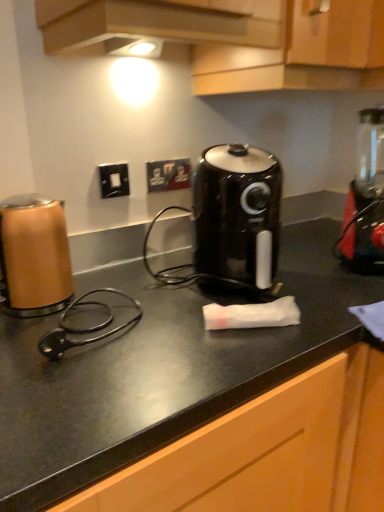
Question: From a real-world perspective, is red plastic blender at right physically above black matte countertop at center?

Choices:
 (A) no
 (B) yes

Answer: (B)

Question: Does red plastic blender at right have a greater height compared to black matte countertop at center?

Choices:
 (A) yes
 (B) no

Answer: (B)

Question: Can you confirm if red plastic blender at right is positioned to the left of black matte countertop at center?

Choices:
 (A) yes
 (B) no

Answer: (B)

Question: Is red plastic blender at right outside of black matte countertop at center?

Choices:
 (A) no
 (B) yes

Answer: (B)

Question: Can you confirm if red plastic blender at right is positioned to the right of black matte countertop at center?

Choices:
 (A) no
 (B) yes

Answer: (B)

Question: Is red plastic blender at right thinner than black matte countertop at center?

Choices:
 (A) yes
 (B) no

Answer: (A)

Question: Is black plastic air fryer at center aimed at copper metallic kettle at left?

Choices:
 (A) yes
 (B) no

Answer: (B)

Question: Considering the relative positions of black plastic air fryer at center and copper metallic kettle at left in the image provided, is black plastic air fryer at center to the right of copper metallic kettle at left from the viewer's perspective?

Choices:
 (A) yes
 (B) no

Answer: (A)

Question: From the image's perspective, does black plastic air fryer at center appear higher than copper metallic kettle at left?

Choices:
 (A) no
 (B) yes

Answer: (B)

Question: From a real-world perspective, does black plastic air fryer at center stand above copper metallic kettle at left?

Choices:
 (A) no
 (B) yes

Answer: (B)

Question: Can you confirm if black plastic air fryer at center is smaller than copper metallic kettle at left?

Choices:
 (A) yes
 (B) no

Answer: (B)

Question: Can you confirm if black plastic air fryer at center is wider than copper metallic kettle at left?

Choices:
 (A) no
 (B) yes

Answer: (B)

Question: From a real-world perspective, is copper metallic kettle at left below black plastic air fryer at center?

Choices:
 (A) no
 (B) yes

Answer: (B)